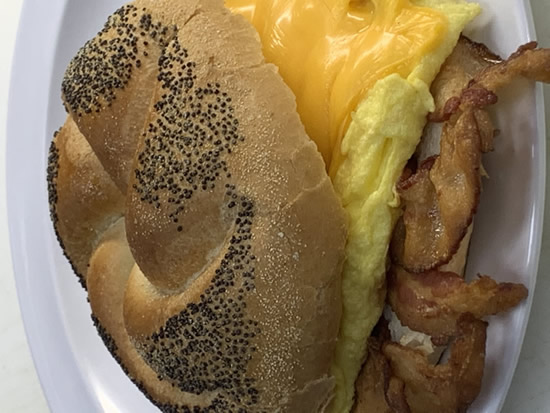
In order to click on plate in this screenshot , I will do `click(341, 391)`.